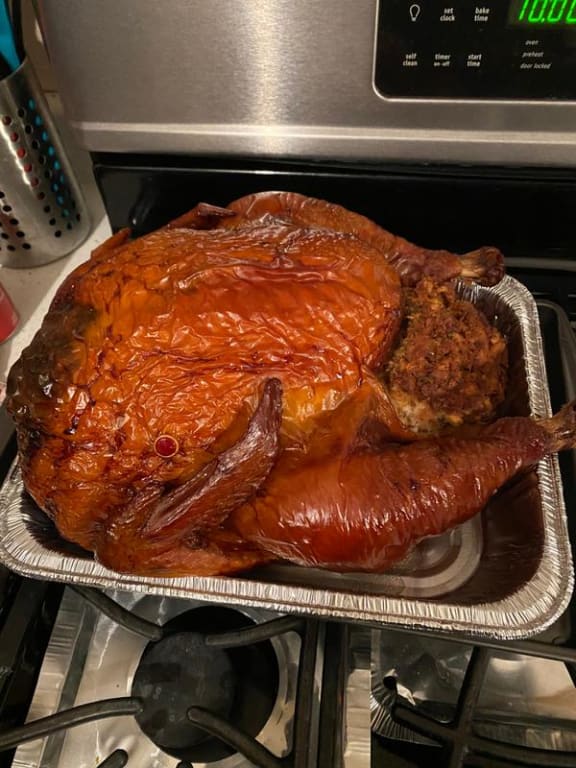
At what (x,y) coordinates should I click in order to perform the action: click on tray. Please return your answer as a coordinate pair (x, y). Looking at the image, I should click on (518, 591).